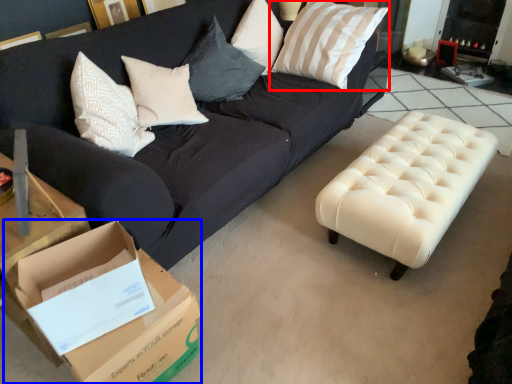
Question: Which object is closer to the camera taking this photo, pillow (highlighted by a red box) or cardboard box (highlighted by a blue box)?

Choices:
 (A) pillow
 (B) cardboard box

Answer: (B)